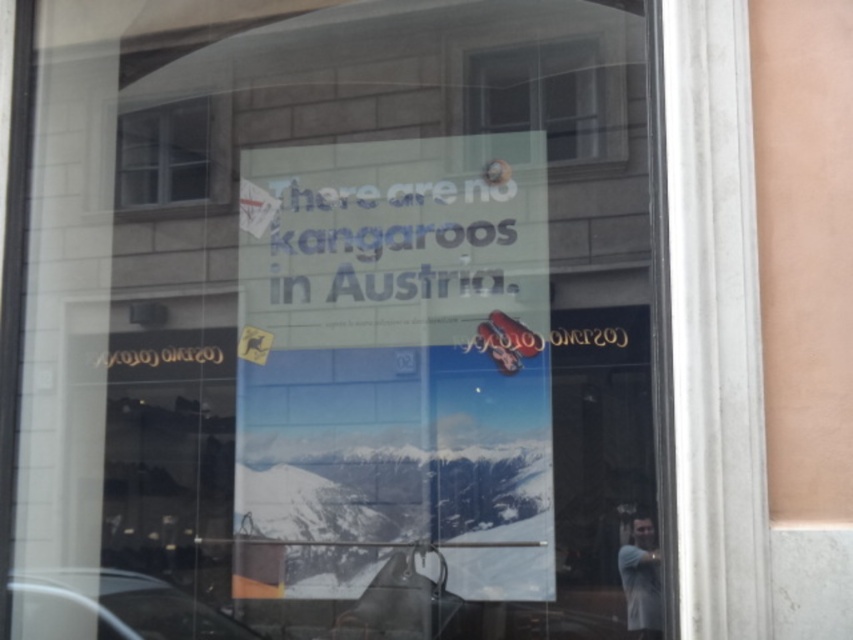
Between transparent glass window at upper center and gray fabric skier at lower right, which one has more height?

Standing taller between the two is transparent glass window at upper center.

Can you confirm if transparent glass window at upper center is shorter than gray fabric skier at lower right?

No, transparent glass window at upper center is not shorter than gray fabric skier at lower right.

What do you see at coordinates (550, 99) in the screenshot?
I see `transparent glass window at upper center` at bounding box center [550, 99].

Identify the location of transparent glass window at upper center. The height and width of the screenshot is (640, 853). coord(550,99).

Does white glass window at upper left have a lesser width compared to gray fabric skier at lower right?

In fact, white glass window at upper left might be wider than gray fabric skier at lower right.

Who is taller, white glass window at upper left or gray fabric skier at lower right?

white glass window at upper left is taller.

The height and width of the screenshot is (640, 853). In order to click on white glass window at upper left in this screenshot , I will do `click(166, 152)`.

The width and height of the screenshot is (853, 640). I want to click on white glass window at upper left, so click(x=166, y=152).

Does transparent glass window at upper center have a greater height compared to white glass window at upper left?

Correct, transparent glass window at upper center is much taller as white glass window at upper left.

Does transparent glass window at upper center come in front of white glass window at upper left?

Yes.

I want to click on transparent glass window at upper center, so click(550, 99).